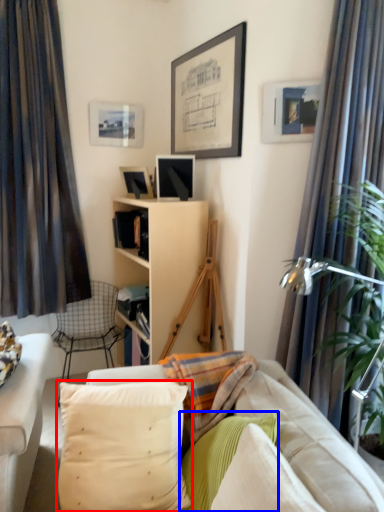
Question: Among these objects, which one is farthest to the camera, pillow (highlighted by a red box) or pillow (highlighted by a blue box)?

Choices:
 (A) pillow
 (B) pillow

Answer: (A)